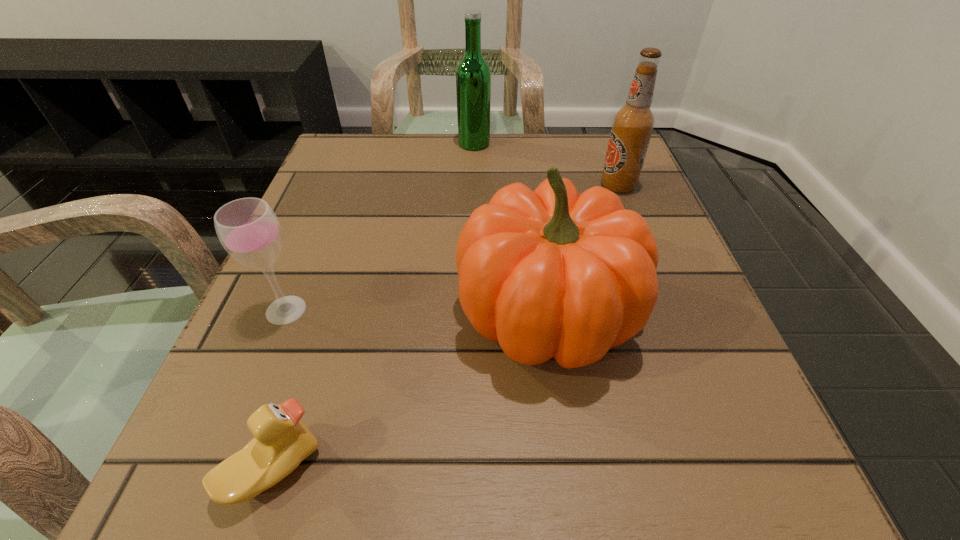
In order to click on object located in the near left corner section of the desktop in this screenshot , I will do `click(281, 441)`.

Locate an element on the screen. object positioned at the far right corner is located at coordinates (632, 126).

At what (x,y) coordinates should I click in order to perform the action: click on free region at the far edge of the desktop. Please return your answer as a coordinate pair (x, y). This screenshot has height=540, width=960. Looking at the image, I should click on (474, 169).

Locate an element on the screen. vacant area at the near edge is located at coordinates click(x=402, y=511).

This screenshot has width=960, height=540. Find the location of `free region at the left edge of the desktop`. free region at the left edge of the desktop is located at coordinates pos(242,406).

The height and width of the screenshot is (540, 960). I want to click on free space at the right edge of the desktop, so click(691, 328).

Where is `free space at the far left corner`? The image size is (960, 540). free space at the far left corner is located at coordinates (348, 163).

You are a GUI agent. You are given a task and a screenshot of the screen. Output one action in this format:
    pyautogui.click(x=<x>, y=<y>)
    Task: Click on the vacant region at the far right corner of the desktop
    
    Given the screenshot: What is the action you would take?
    pyautogui.click(x=579, y=158)

The image size is (960, 540). I want to click on vacant point located between the second shortest object and the pumpkin, so click(417, 311).

The image size is (960, 540). What are the coordinates of `vacant region between the farthest object and the wineglass` in the screenshot? It's located at (380, 227).